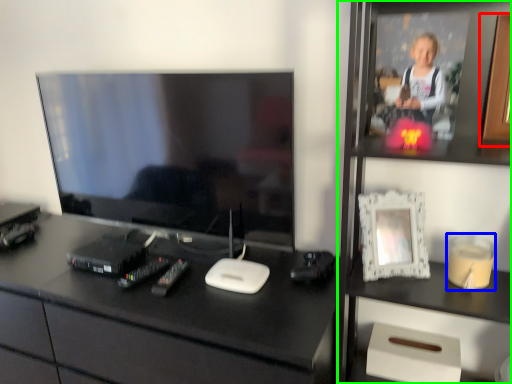
Question: Which object is positioned closest to picture frame (highlighted by a red box)? Select from candle holder (highlighted by a blue box) and bookshelf (highlighted by a green box).

Choices:
 (A) candle holder
 (B) bookshelf

Answer: (B)